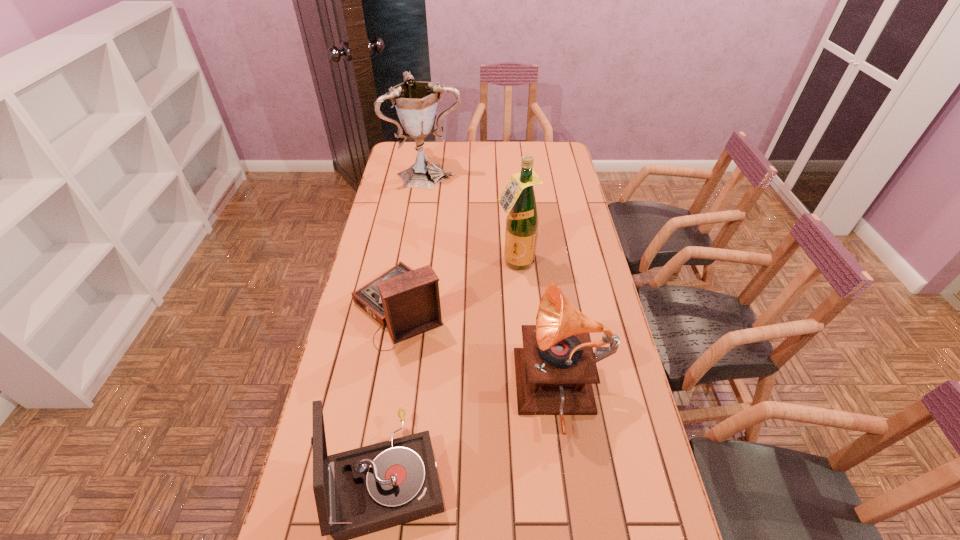
You are a GUI agent. You are given a task and a screenshot of the screen. Output one action in this format:
    pyautogui.click(x=<x>, y=<y>)
    Task: Click on the vacant area that lies between the farthest object and the shortest phonograph record
    This screenshot has height=540, width=960.
    Given the screenshot: What is the action you would take?
    pyautogui.click(x=414, y=240)

I want to click on free area in between the shortest object and the liquor, so [457, 285].

This screenshot has width=960, height=540. Identify the location of object that ranks as the second closest to the fourth tallest object. (407, 301).

Image resolution: width=960 pixels, height=540 pixels. I want to click on the second closest object to the farthest object, so click(407, 301).

Point out which phonograph record is positioned as the third nearest to the liquor. Please provide its 2D coordinates. Your answer should be formatted as a tuple, i.e. [(x, y)], where the tuple contains the x and y coordinates of a point satisfying the conditions above.

[(357, 492)]

Identify the location of phonograph record that can be found as the second closest to the farthest object. (555, 369).

What are the coordinates of `vacant region that satisfies the following two spatial constraints: 1. on the back side of the farthest object; 2. on the left side of the shortest object` in the screenshot? It's located at (421, 173).